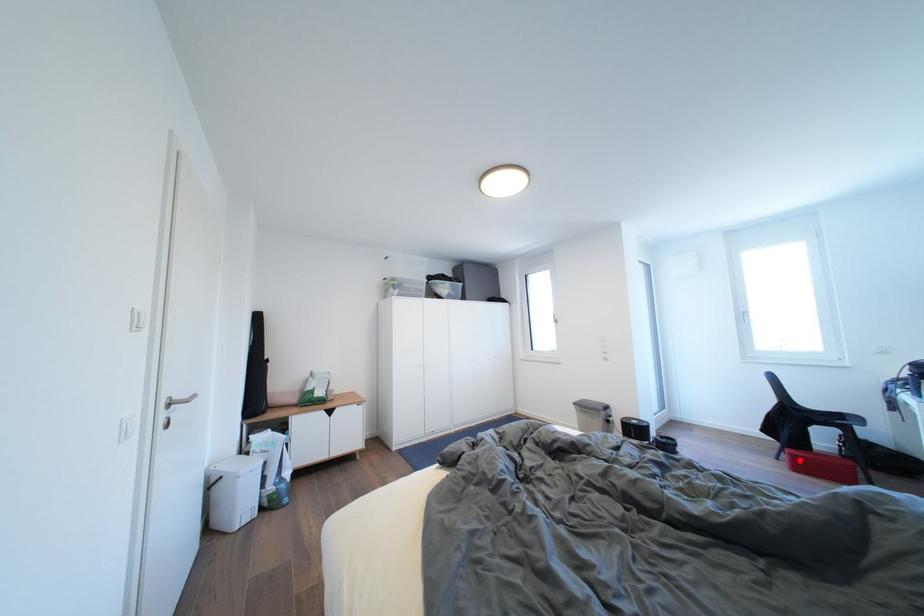
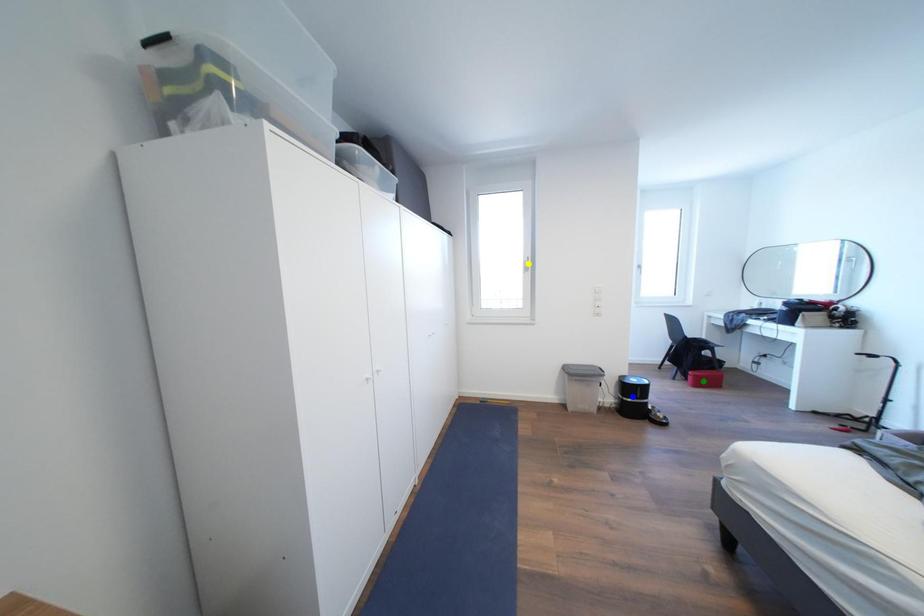
Question: I am providing you with two images of the same scene from different viewpoints. A red point is marked on the first image. You are given multiple points on the second image. Can you choose the point in image 2 that corresponds to the point in image 1?

Choices:
 (A) green point
 (B) yellow point
 (C) blue point

Answer: (A)